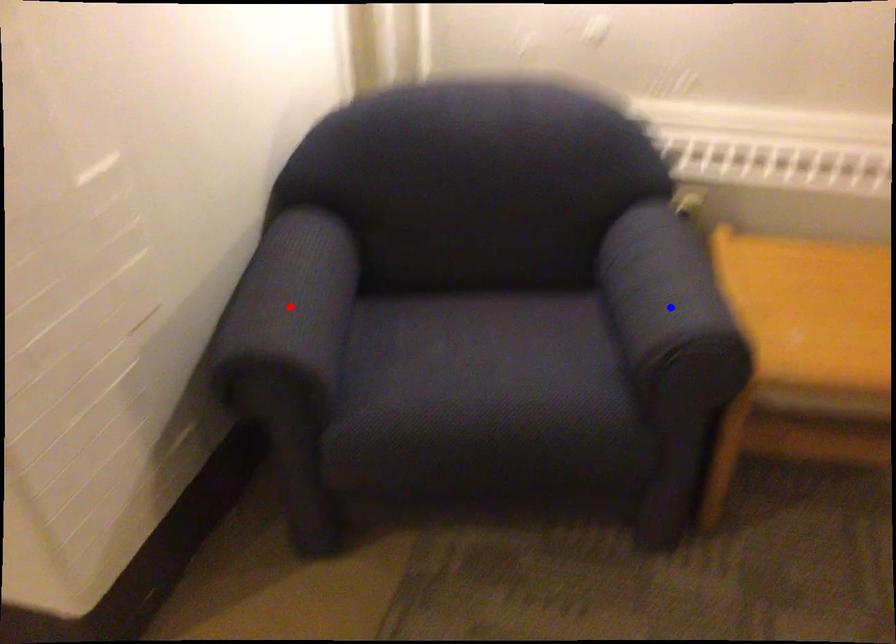
Question: Which of the two points in the image is closer to the camera?

Choices:
 (A) Blue point is closer.
 (B) Red point is closer.

Answer: (B)